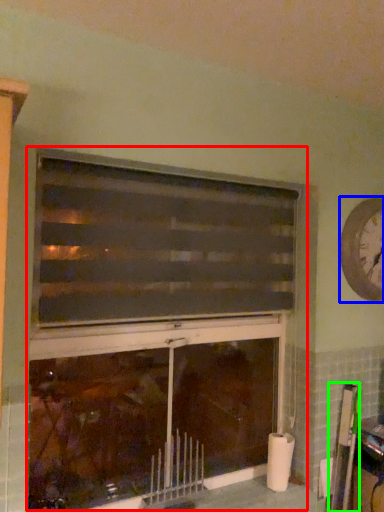
Question: Which is farther away from fireplace (highlighted by a red box)? clock (highlighted by a blue box) or bulletin board (highlighted by a green box)?

Choices:
 (A) clock
 (B) bulletin board

Answer: (B)